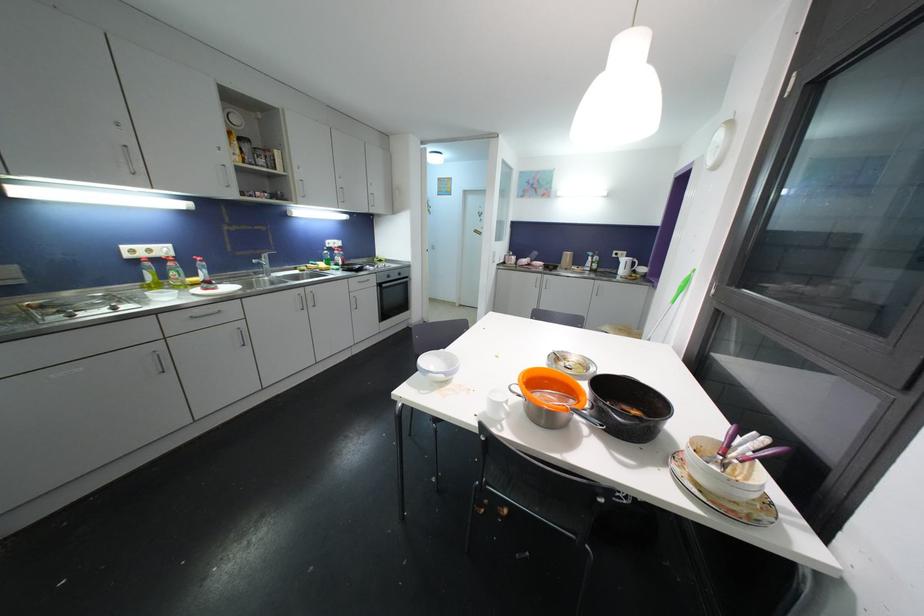
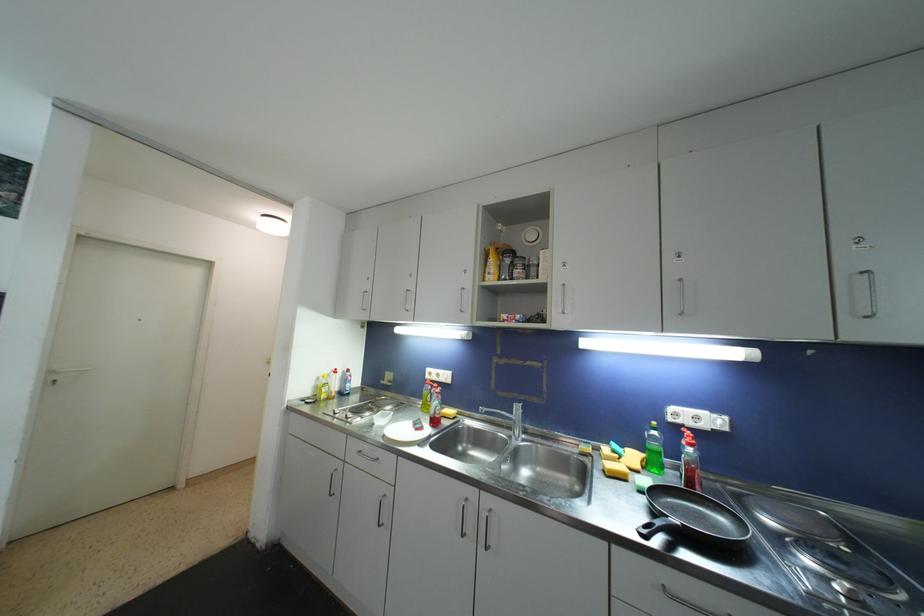
The point at (x=339, y=248) is marked in the first image. Where is the corresponding point in the second image?

(708, 429)